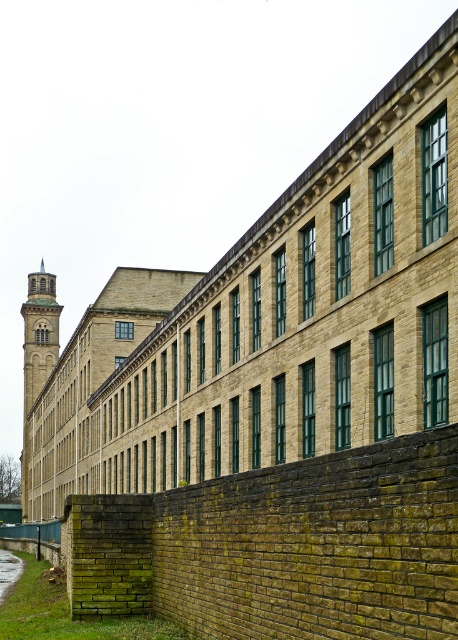
Question: Does stone clock tower at left lie in front of green grass at lower left?

Choices:
 (A) no
 (B) yes

Answer: (A)

Question: Which of the following is the farthest from the observer?

Choices:
 (A) stone clock tower at left
 (B) green grass at lower left

Answer: (A)

Question: Is stone clock tower at left wider than green grass at lower left?

Choices:
 (A) no
 (B) yes

Answer: (B)

Question: Which point appears closest to the camera in this image?

Choices:
 (A) (33, 401)
 (B) (7, 588)

Answer: (B)

Question: Can you confirm if stone clock tower at left is thinner than green grass at lower left?

Choices:
 (A) no
 (B) yes

Answer: (A)